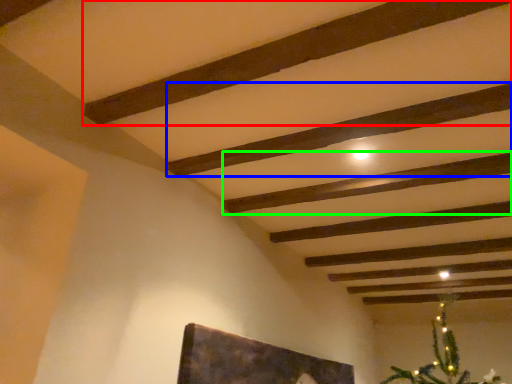
Question: Which is farther away from plank (highlighted by a red box)? plank (highlighted by a blue box) or plank (highlighted by a green box)?

Choices:
 (A) plank
 (B) plank

Answer: (B)